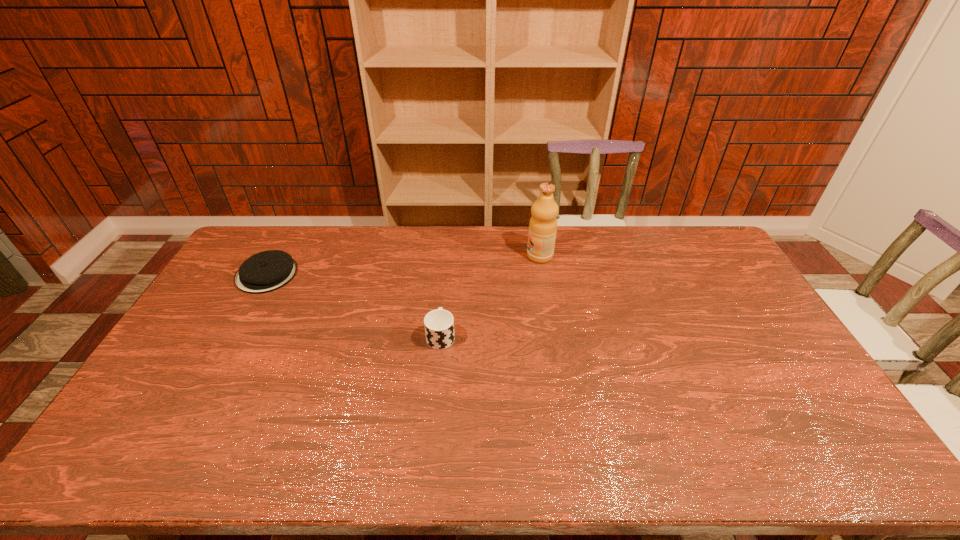
Image resolution: width=960 pixels, height=540 pixels. What are the coordinates of `free space between the shortest object and the second object from left to right` in the screenshot? It's located at (354, 305).

Find the location of `the second closest object to the leftmost object`. the second closest object to the leftmost object is located at coordinates (543, 224).

Identify the location of object that is the closest to the second tallest object. This screenshot has height=540, width=960. (543, 224).